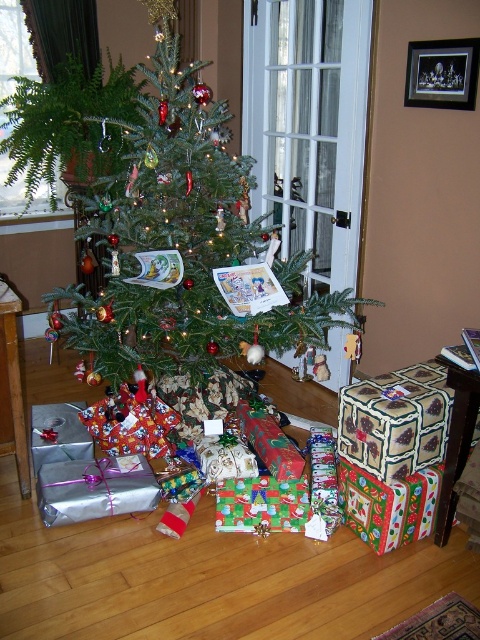
You are a delivery person who just arrived with a new package. You need to place it somewhere near the green matte christmas tree at center without blocking the view of the green leafy plant at upper left. Where should you place the package?

Place the package near the base of the green matte christmas tree at center. Since the green matte christmas tree at center might be wider than the green leafy plant at upper left, placing the package at the base ensures it won not block the view of the plant.

You are a guest at a Christmas party and want to place a small gift under the tree. The gift requires a space of 30 cm. The green leafy plant at upper left is near the edge of the room. Can the green matte christmas tree at center provide enough space for the gift?

The green matte christmas tree at center is larger than the green leafy plant at upper left. Since the plant is near the edge, the tree likely occupies more space, so there should be enough room under the green matte christmas tree at center for the 30 cm gift.